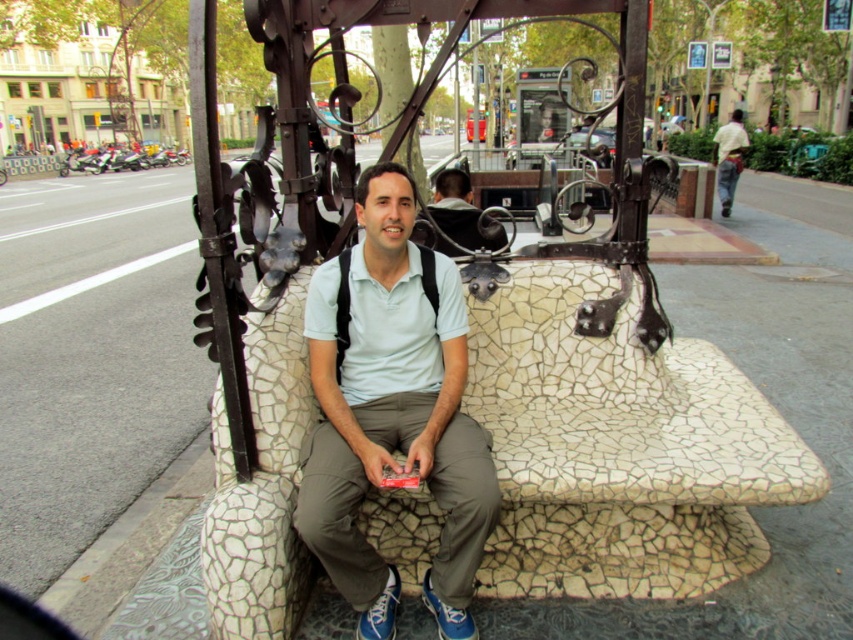
Does matte white shirt at center appear over light yellow shirt at right?

Actually, matte white shirt at center is below light yellow shirt at right.

In the scene shown: Can you confirm if matte white shirt at center is smaller than light yellow shirt at right?

Correct, matte white shirt at center occupies less space than light yellow shirt at right.

What do you see at coordinates (392, 410) in the screenshot? The width and height of the screenshot is (853, 640). I see `matte white shirt at center` at bounding box center [392, 410].

At what (x,y) coordinates should I click in order to perform the action: click on matte white shirt at center. Please return your answer as a coordinate pair (x, y). Image resolution: width=853 pixels, height=640 pixels. Looking at the image, I should click on point(392,410).

Does matte white bench at center appear under light yellow shirt at right?

Indeed, matte white bench at center is positioned under light yellow shirt at right.

Can you confirm if matte white bench at center is shorter than light yellow shirt at right?

Correct, matte white bench at center is not as tall as light yellow shirt at right.

Between point (457, 250) and point (734, 164), which one is positioned behind?

The point (734, 164) is behind.

Find the location of a particular element. The height and width of the screenshot is (640, 853). matte white bench at center is located at coordinates (462, 212).

Who is higher up, matte white shirt at center or matte white bench at center?

matte white bench at center is higher up.

Is point (462, 593) more distant than point (437, 216)?

No, (462, 593) is closer to viewer.

Where is `matte white shirt at center`? Image resolution: width=853 pixels, height=640 pixels. matte white shirt at center is located at coordinates (392, 410).